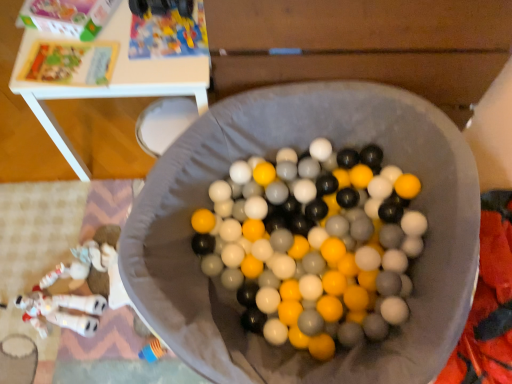
Question: Should I look upward or downward to see white plastic table at upper center?

Choices:
 (A) up
 (B) down

Answer: (A)